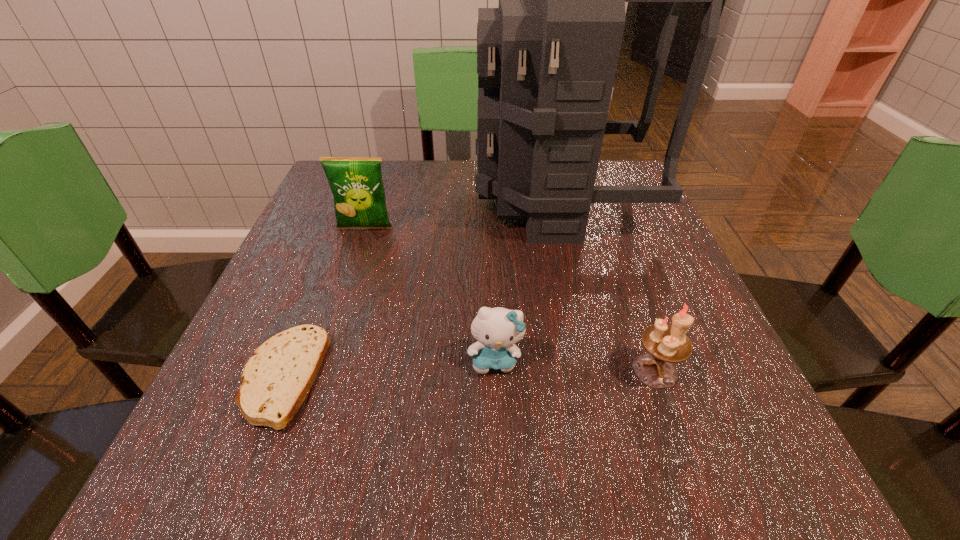
Locate an element on the screen. The height and width of the screenshot is (540, 960). vacant space situated 0.120m on the face of the fourth tallest object is located at coordinates (498, 456).

Where is `vacant space located on the back of the shortest object`? Image resolution: width=960 pixels, height=540 pixels. vacant space located on the back of the shortest object is located at coordinates (339, 234).

At what (x,y) coordinates should I click in order to perform the action: click on object that is at the far edge. Please return your answer as a coordinate pair (x, y). The image size is (960, 540). Looking at the image, I should click on (547, 57).

Identify the location of object at the near edge. (276, 380).

At what (x,y) coordinates should I click in order to perform the action: click on crisp (potato chip) located in the left edge section of the desktop. Please return your answer as a coordinate pair (x, y). This screenshot has height=540, width=960. Looking at the image, I should click on (356, 183).

Find the location of a particular element. Image resolution: width=960 pixels, height=540 pixels. pita bread at the left edge is located at coordinates (276, 380).

This screenshot has height=540, width=960. Find the location of `backpack located at the right edge`. backpack located at the right edge is located at coordinates (547, 57).

Where is `candle holder present at the right edge`? candle holder present at the right edge is located at coordinates (665, 345).

In order to click on object that is at the near left corner in this screenshot , I will do `click(276, 380)`.

Where is `object located at the far right corner`? object located at the far right corner is located at coordinates (547, 57).